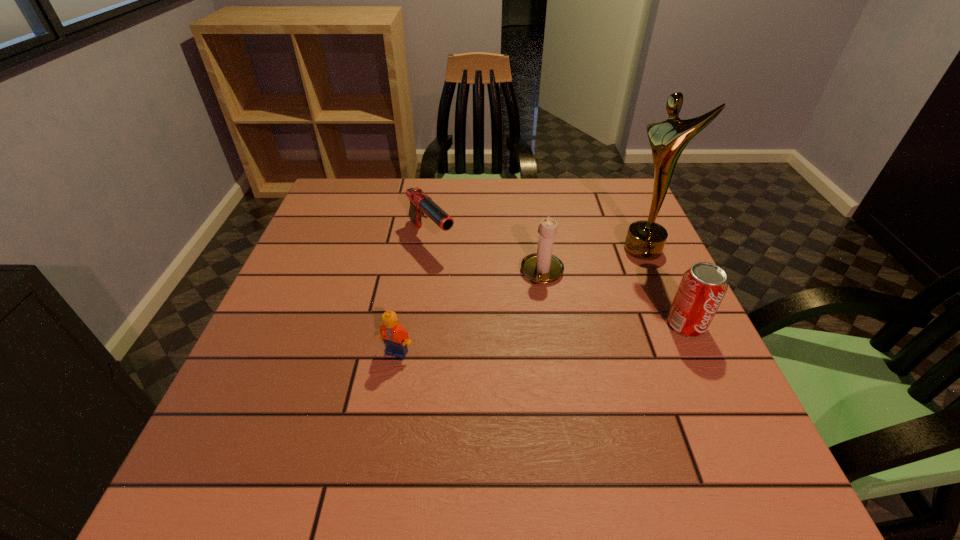
Identify the location of vacant space on the desktop that is between the Lego and the soda can and is positioned at the aiming end of the gun. (532, 339).

What are the coordinates of `vacant space on the desktop that is between the Lego and the second nearest object and is positioned on the front-facing side of the award` in the screenshot? It's located at click(x=505, y=342).

At what (x,y) coordinates should I click in order to perform the action: click on vacant spot on the desktop that is between the Lego and the soda can and is positioned on the handle side of the candle holder. Please return your answer as a coordinate pair (x, y). This screenshot has width=960, height=540. Looking at the image, I should click on (524, 340).